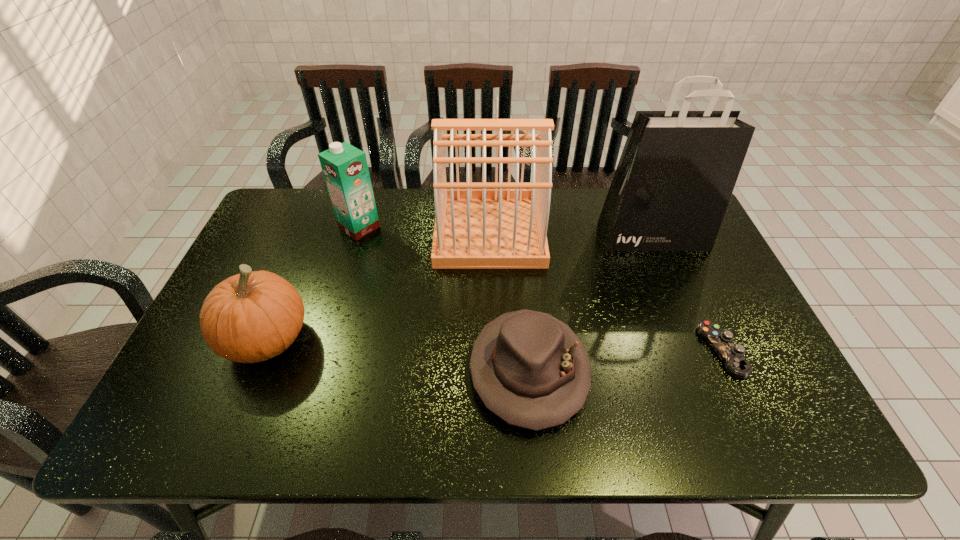
Where is `blank region between the birdcage and the hat`? blank region between the birdcage and the hat is located at coordinates (509, 301).

At what (x,y) coordinates should I click in order to perform the action: click on blank region between the fourth tallest object and the hat. Please return your answer as a coordinate pair (x, y). The width and height of the screenshot is (960, 540). Looking at the image, I should click on (398, 355).

The width and height of the screenshot is (960, 540). I want to click on free point between the second shortest object and the third tallest object, so point(444,299).

Locate an element on the screen. Image resolution: width=960 pixels, height=540 pixels. vacant point located between the birdcage and the shortest object is located at coordinates (606, 291).

You are a GUI agent. You are given a task and a screenshot of the screen. Output one action in this format:
    pyautogui.click(x=<x>, y=<y>)
    Task: Click on the empty space that is in between the hat and the carton
    This screenshot has height=540, width=960.
    Given the screenshot: What is the action you would take?
    pyautogui.click(x=444, y=299)

At what (x,y) coordinates should I click in order to perform the action: click on object identified as the third closest to the shopping bag. Please return your answer as a coordinate pair (x, y). Looking at the image, I should click on (530, 369).

Select which object is the fourth closest to the carton. Please provide its 2D coordinates. Your answer should be formatted as a tuple, i.e. [(x, y)], where the tuple contains the x and y coordinates of a point satisfying the conditions above.

[(677, 171)]

Image resolution: width=960 pixels, height=540 pixels. Find the location of `vacant area that satisfies the following two spatial constraints: 1. on the front with handles of the shopping bag; 2. on the stem of the fourth tallest object`. vacant area that satisfies the following two spatial constraints: 1. on the front with handles of the shopping bag; 2. on the stem of the fourth tallest object is located at coordinates (696, 339).

Locate an element on the screen. This screenshot has width=960, height=540. free spot that satisfies the following two spatial constraints: 1. with an open door on the birdcage; 2. on the left side of the control is located at coordinates (492, 350).

Locate an element on the screen. free space that satisfies the following two spatial constraints: 1. on the front side of the third tallest object; 2. on the stem of the pumpkin is located at coordinates (326, 339).